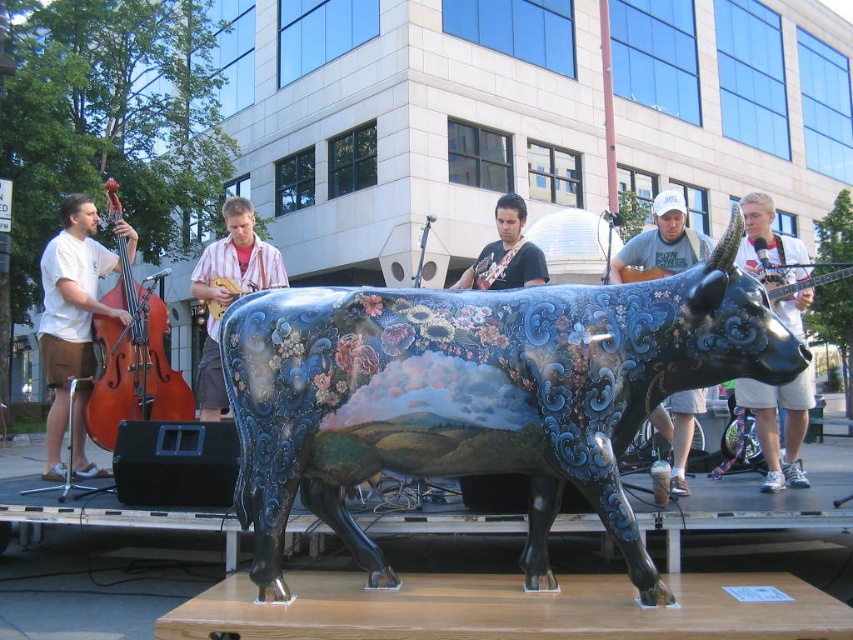
You are a photographer standing at point [71,326]. You want to capture a closeup shot of the large intricately painted cow sculpture. However, there is an object blocking your view at that point. What is the object blocking your shot?

The object blocking your shot at point [71,326] is the matte brown shorts at left.

You are standing at the point with coordinates point (541,269) and want to walk towards the point with coordinates point (64,424). Will the cow sculpture block your path?

Point (64,424) is behind point (541,269), so the cow sculpture will block your path to point (64,424).

You are a photographer standing at the center of the stage. You notice a point marked at coordinates [778,426] in the image. Based on the scene description, where is this point located on the image?

The point at coordinates [778,426] is located on the white cotton shirt at upper right.